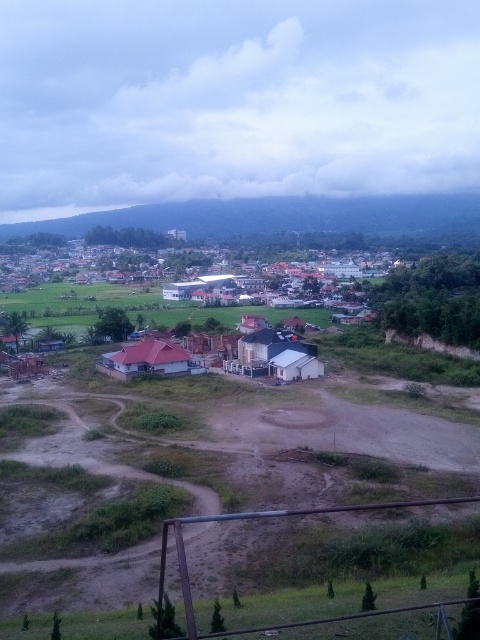
Question: Can you confirm if dull brown dirt field at center is thinner than white matte house at center?

Choices:
 (A) yes
 (B) no

Answer: (A)

Question: Which of the following is the closest to the observer?

Choices:
 (A) white matte house at center
 (B) dull brown dirt field at center

Answer: (B)

Question: From the image, what is the correct spatial relationship of dull brown dirt field at center in relation to white matte house at center?

Choices:
 (A) above
 (B) below

Answer: (B)

Question: Is dull brown dirt field at center to the right of white matte house at center from the viewer's perspective?

Choices:
 (A) no
 (B) yes

Answer: (B)

Question: Among these points, which one is nearest to the camera?

Choices:
 (A) (251, 310)
 (B) (12, 604)

Answer: (B)